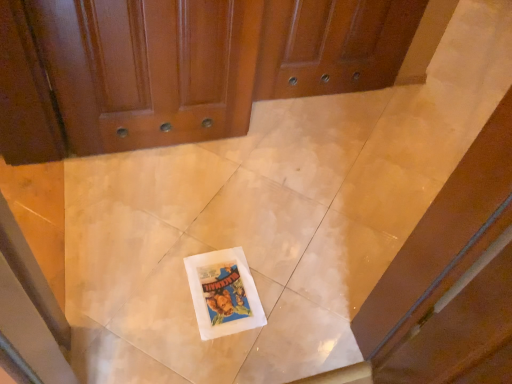
Find the location of a particular element. space that is in front of glossy wood door at upper center is located at coordinates (157, 219).